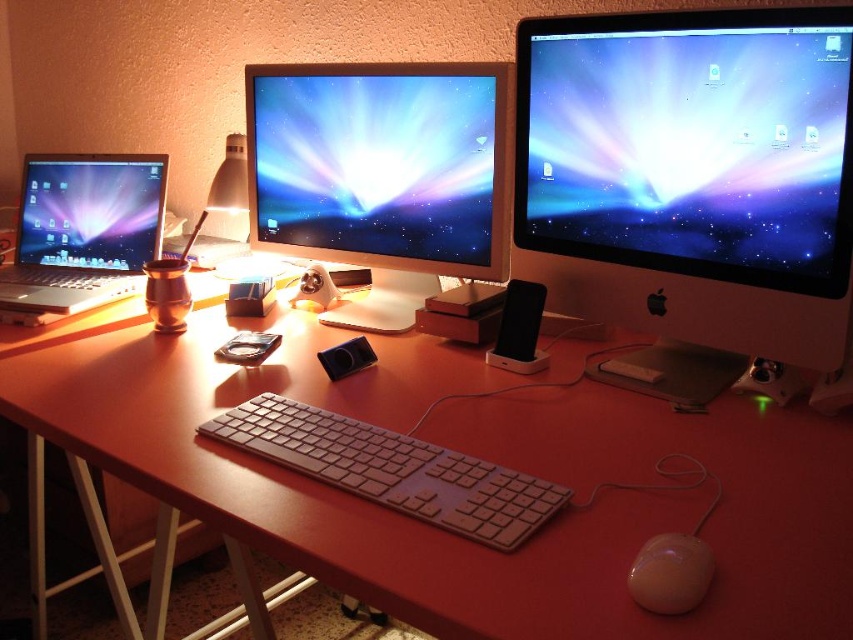
You are a graphic designer working on a project and need to place a new object at the coordinates point (x=691, y=173) on your desk. What object will be at that location?

The point (x=691, y=173) corresponds to the satin silver monitor at upper right.

Based on the photo, you are setting up a new monitor on your desk. You have a glossy plastic monitor at center and a white plastic keyboard at center. Which object is bigger?

The glossy plastic monitor at center is larger in size compared to the white plastic keyboard at center.